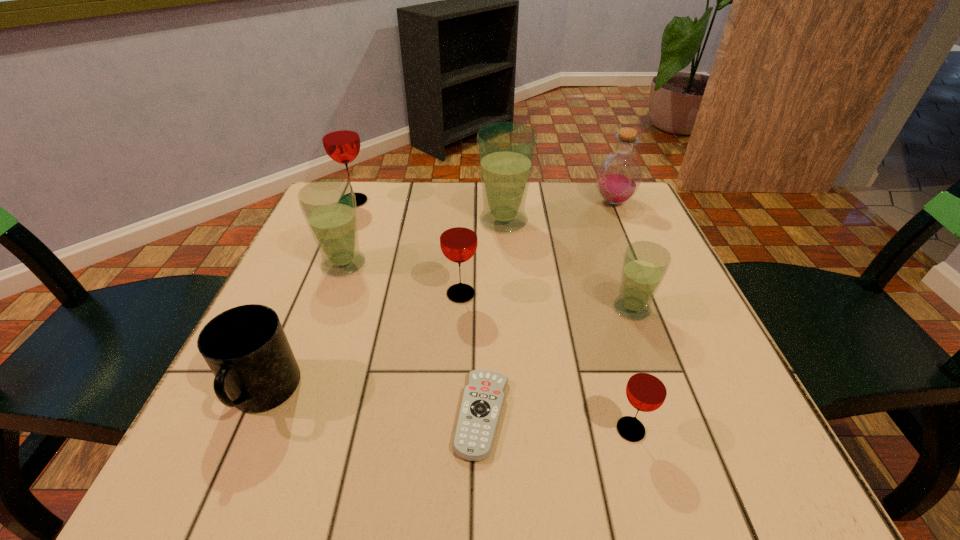
Locate an element on the screen. The height and width of the screenshot is (540, 960). the farthest red glass is located at coordinates (340, 137).

The height and width of the screenshot is (540, 960). In order to click on the leftmost red glass in this screenshot , I will do `click(340, 137)`.

This screenshot has width=960, height=540. Find the location of `the farthest blue glass`. the farthest blue glass is located at coordinates (506, 151).

Image resolution: width=960 pixels, height=540 pixels. Identify the location of the biggest blue glass. (506, 151).

Locate an element on the screen. bottle is located at coordinates (619, 175).

You are a GUI agent. You are given a task and a screenshot of the screen. Output one action in this format:
    pyautogui.click(x=<x>, y=<y>)
    Task: Click on the second smallest red glass
    Image resolution: width=960 pixels, height=540 pixels.
    Given the screenshot: What is the action you would take?
    pyautogui.click(x=458, y=238)

Locate an element on the screen. The height and width of the screenshot is (540, 960). the second red glass from left to right is located at coordinates (458, 238).

At what (x,y) coordinates should I click in order to perform the action: click on the second smallest blue glass. Please return your answer as a coordinate pair (x, y). Looking at the image, I should click on (329, 205).

I want to click on the third farthest glass, so click(x=329, y=205).

Find the location of a particular element. the smallest blue glass is located at coordinates (645, 264).